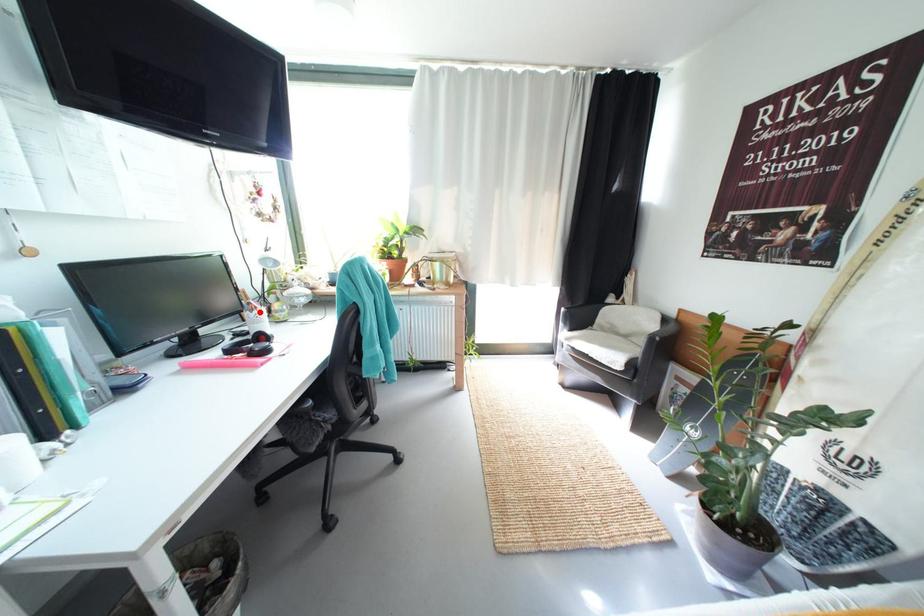
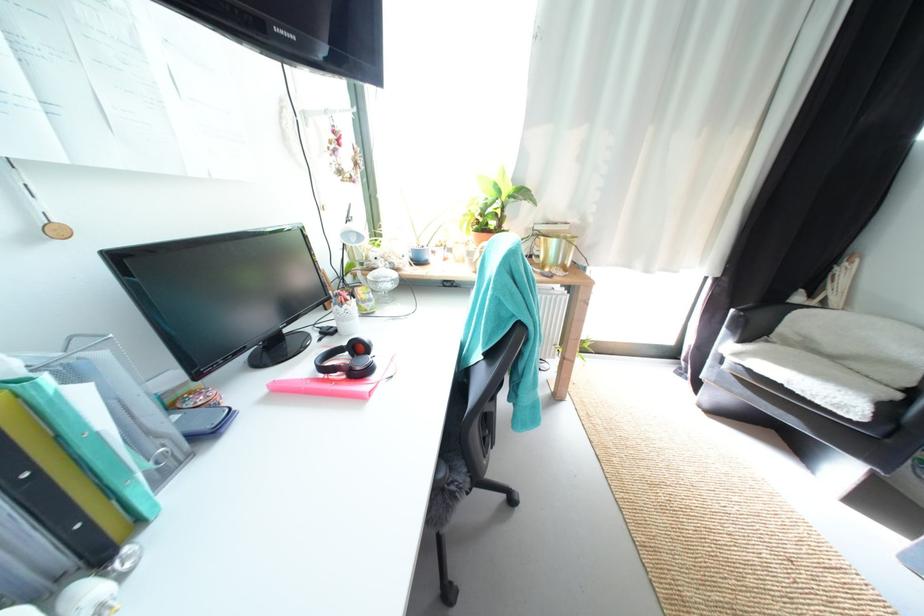
Where in the second image is the point corresponding to the highlighted location from the first image?

(348, 306)